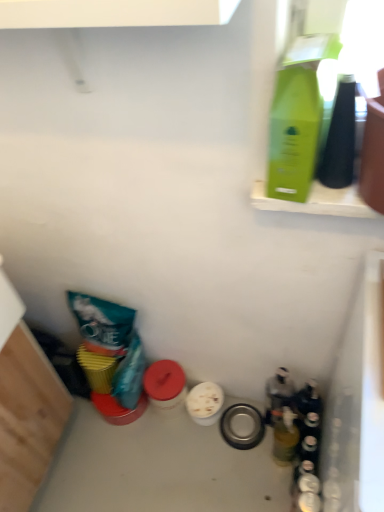
Question: Is translucent glass bottle at lower right, which ranks as the 2th bottle in front-to-back order, far away from green matte bottle at upper right, marked as the 1th bottle in a top-to-bottom arrangement?

Choices:
 (A) yes
 (B) no

Answer: (B)

Question: Is translucent glass bottle at lower right, which ranks as the 2th bottle in front-to-back order, to the left of green matte bottle at upper right, placed as the third bottle when sorted from bottom to top, from the viewer's perspective?

Choices:
 (A) no
 (B) yes

Answer: (A)

Question: From a real-world perspective, does translucent glass bottle at lower right, which is the third bottle in top-to-bottom order, sit lower than green matte bottle at upper right, marked as the 1th bottle in a top-to-bottom arrangement?

Choices:
 (A) no
 (B) yes

Answer: (B)

Question: Is translucent glass bottle at lower right, which ranks as the 1th bottle in bottom-to-top order, smaller than green matte bottle at upper right, placed as the third bottle when sorted from bottom to top?

Choices:
 (A) no
 (B) yes

Answer: (B)

Question: From the image's perspective, is translucent glass bottle at lower right, which is the third bottle in top-to-bottom order, over green matte bottle at upper right, which is counted as the first bottle, starting from the front?

Choices:
 (A) no
 (B) yes

Answer: (A)

Question: Would you say green matte bottle at upper right, which is counted as the first bottle, starting from the front, is to the left or to the right of translucent glass bottle at lower right, the 1th bottle positioned from the back, in the picture?

Choices:
 (A) right
 (B) left

Answer: (B)

Question: From the image's perspective, is green matte bottle at upper right, the 3th bottle in the back-to-front sequence, above or below translucent glass bottle at lower right, arranged as the 3th bottle when viewed from the front?

Choices:
 (A) above
 (B) below

Answer: (A)

Question: In terms of height, does green matte bottle at upper right, placed as the third bottle when sorted from bottom to top, look taller or shorter compared to translucent glass bottle at lower right, which is the 2th bottle in top-to-bottom order?

Choices:
 (A) tall
 (B) short

Answer: (B)

Question: Considering their positions, is green matte bottle at upper right, placed as the third bottle when sorted from bottom to top, located in front of or behind translucent glass bottle at lower right, arranged as the 3th bottle when viewed from the front?

Choices:
 (A) behind
 (B) front

Answer: (B)

Question: Would you say translucent glass bottle at lower right, the 1th bottle positioned from the back, is to the left or to the right of green matte bottle at upper right, marked as the 1th bottle in a top-to-bottom arrangement, in the picture?

Choices:
 (A) right
 (B) left

Answer: (A)

Question: From a real-world perspective, is translucent glass bottle at lower right, arranged as the 3th bottle when viewed from the front, physically located above or below green matte bottle at upper right, the 3th bottle in the back-to-front sequence?

Choices:
 (A) below
 (B) above

Answer: (A)

Question: From the image's perspective, is translucent glass bottle at lower right, the 1th bottle positioned from the back, positioned above or below green matte bottle at upper right, marked as the 1th bottle in a top-to-bottom arrangement?

Choices:
 (A) below
 (B) above

Answer: (A)

Question: Is translucent glass bottle at lower right, which appears as the second bottle when ordered from the bottom, wider or thinner than green matte bottle at upper right, which is counted as the first bottle, starting from the front?

Choices:
 (A) thin
 (B) wide

Answer: (A)

Question: Considering the relative positions of translucent glass bottle at lower right, which is the third bottle in top-to-bottom order, and green matte bottle at upper right, marked as the 1th bottle in a top-to-bottom arrangement, in the image provided, is translucent glass bottle at lower right, which is the third bottle in top-to-bottom order, to the left or to the right of green matte bottle at upper right, marked as the 1th bottle in a top-to-bottom arrangement,?

Choices:
 (A) right
 (B) left

Answer: (A)

Question: From the image's perspective, is translucent glass bottle at lower right, which is the third bottle in top-to-bottom order, above or below green matte bottle at upper right, marked as the 1th bottle in a top-to-bottom arrangement?

Choices:
 (A) below
 (B) above

Answer: (A)